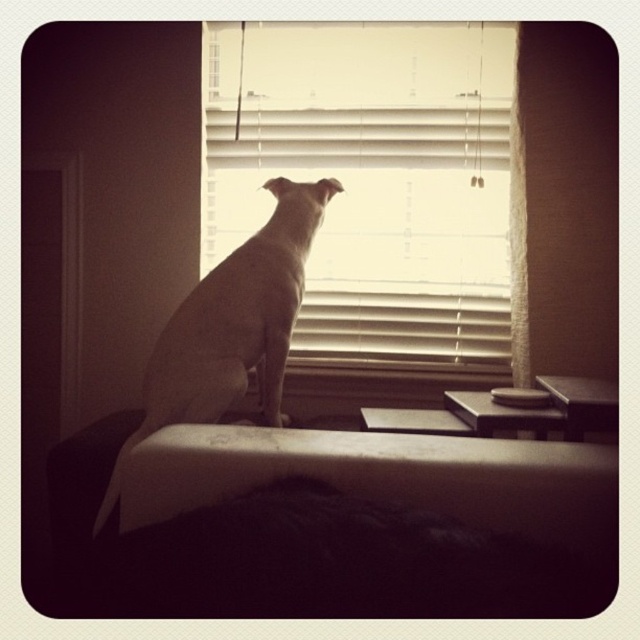
You are a pet sitter who needs to ensure the white smooth dog at center has enough space to move comfortably on the white fabric bed at center. Based on the scene, can the dog move freely on the bed?

The white fabric bed at center is larger in size than the white smooth dog at center, so the dog should have enough space to move freely on the bed.

You are a delivery robot with a box that is 20 inches long. You need to move the box through the space between the white blinds at center and the white smooth dog at center. Can the box fit through that space?

The distance between the white blinds at center and the white smooth dog at center is 17.68 inches. Since the box is 20 inches long, it cannot fit through the space as the box is longer than the available distance.

You are a photographer trying to capture the dog in the scene. Since the white blinds at center and the white smooth dog at center are both white, how can you distinguish them in your photo?

The white blinds at center has a larger size compared to the white smooth dog at center, so you can distinguish them by their size difference.